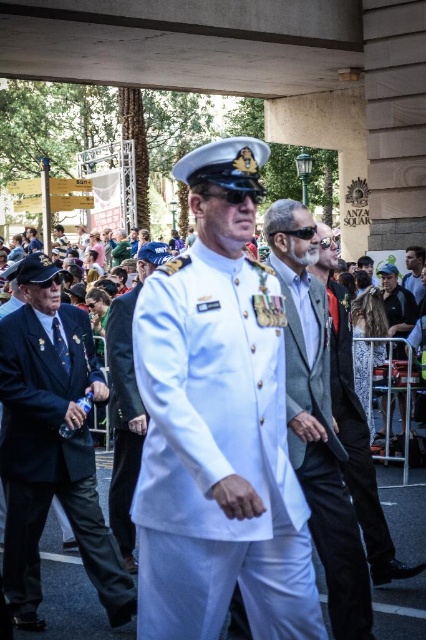
You are standing at point (423, 259) and want to walk to point (120, 490). Which direction should you move relative to the man in the white naval uniform?

You should move forward towards the man in the white naval uniform because point (120, 490) is in front of point (423, 259).